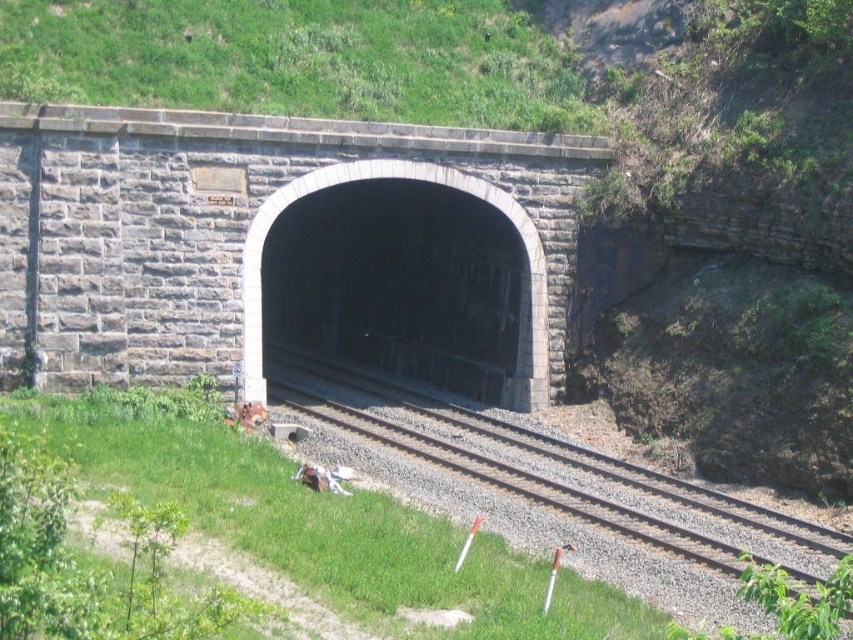
You are a railway inspector standing at the entrance of the tunnel. You need to walk to the dark gray stone tunnel at center to check its structural integrity. Which direction should you move relative to the gravel railroad tracks at center?

Since the gravel railroad tracks at center are closer to the viewer than the dark gray stone tunnel at center, you should move away from the gravel railroad tracks at center towards the dark gray stone tunnel at center to reach it.

You are a railway inspector checking the tunnel entrance. You need to ensure the gravel railroad tracks at center can fit within the dark gray stone tunnel at center. Based on their widths, is this possible?

The gravel railroad tracks at center are wider than the dark gray stone tunnel at center, so they cannot fit within the tunnel.